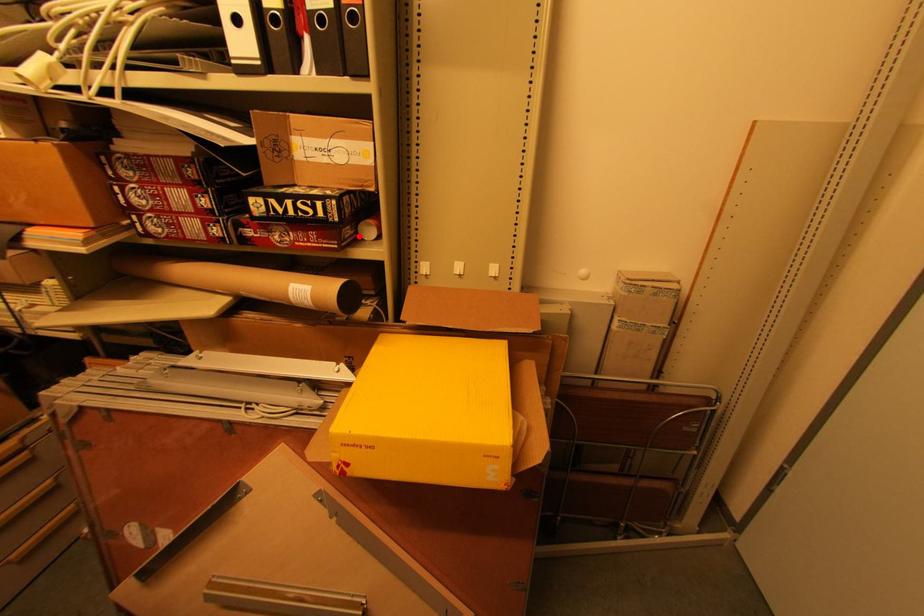
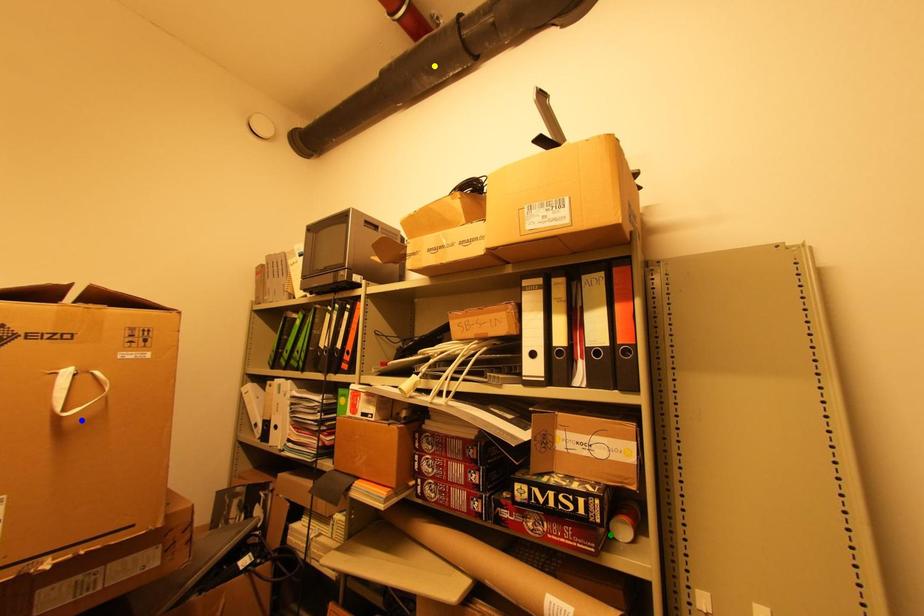
Question: I am providing you with two images of the same scene from different viewpoints. A red point is marked on the first image. You are given multiple points on the second image. Which point in image 2 is actually the same real-world point as the red point in image 1?

Choices:
 (A) blue point
 (B) green point
 (C) yellow point

Answer: (B)